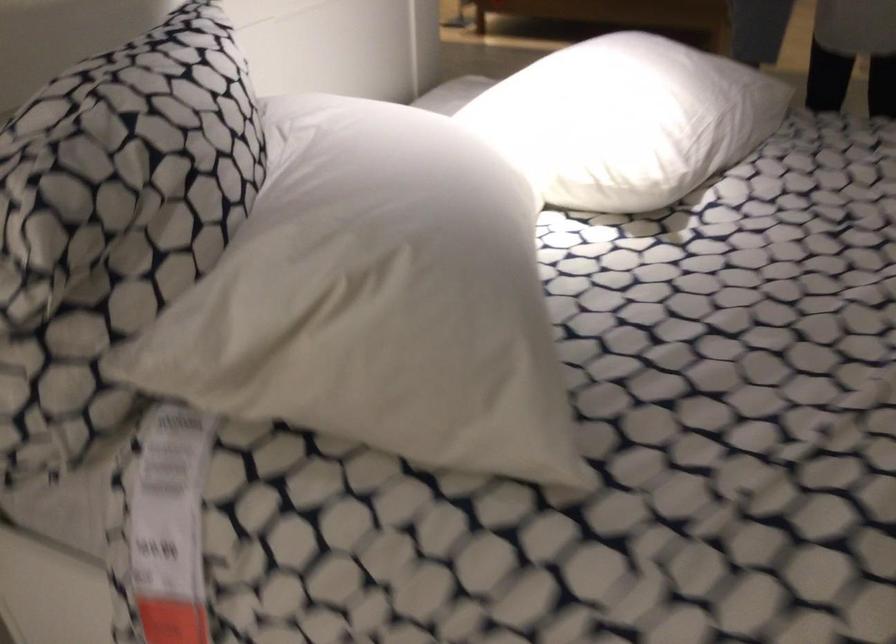
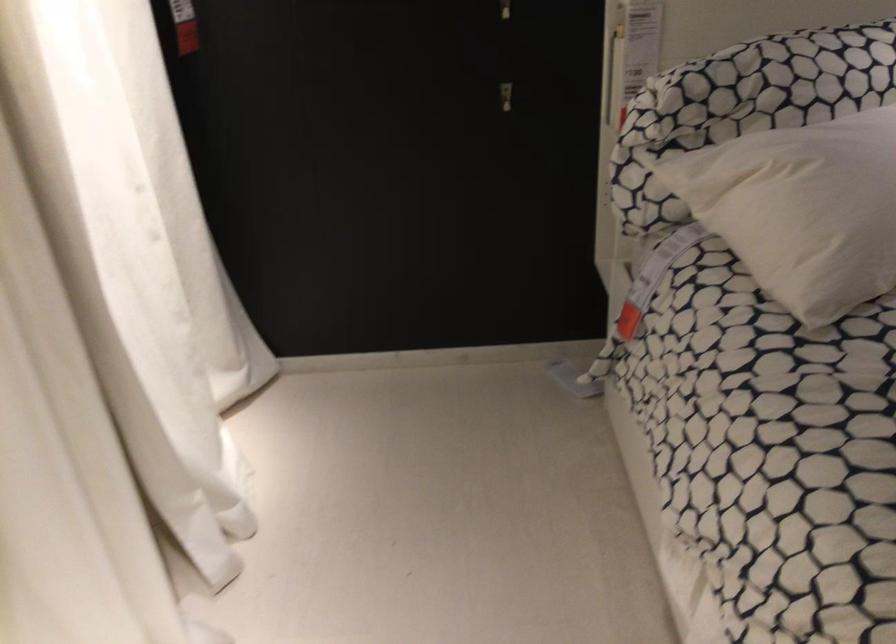
Looking at this image, first-person continuous shooting, in which direction is the camera rotating?

The camera rotated toward left-down.